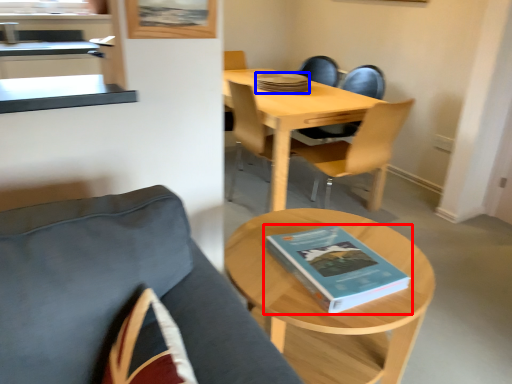
Question: Which object appears farthest to the camera in this image, book (highlighted by a red box) or book (highlighted by a blue box)?

Choices:
 (A) book
 (B) book

Answer: (B)